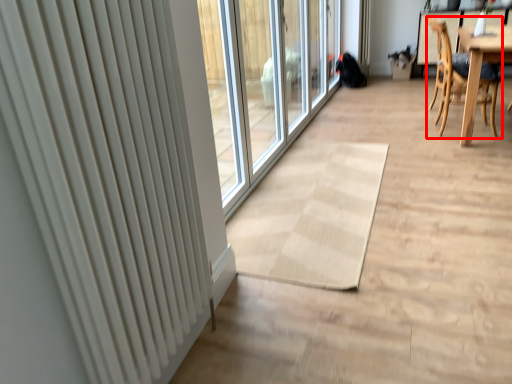
Question: From the image's perspective, where is chair (annotated by the red box) located in relation to radiator in the image?

Choices:
 (A) below
 (B) above

Answer: (B)